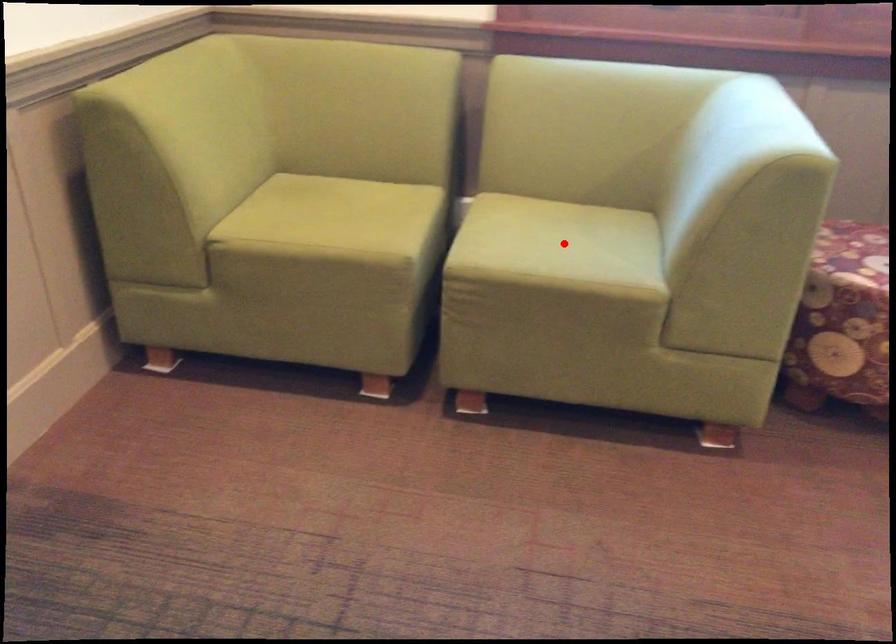
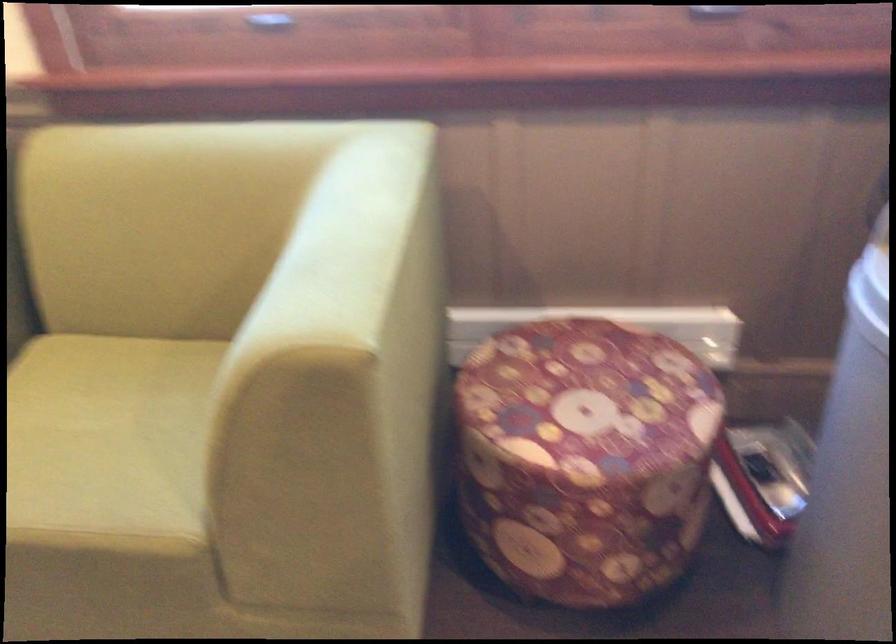
Question: I am providing you with two images of the same scene from different viewpoints. Image1 has a red point marked. In image2, the corresponding 3D location appears at what relative position? Reply with the corresponding letter.

Choices:
 (A) Closer
 (B) Farther

Answer: (A)